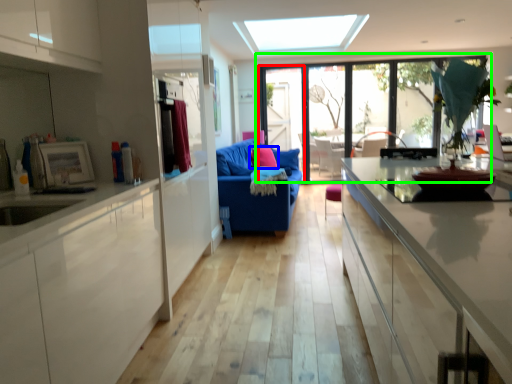
Question: Considering the real-world distances, which object is closest to screen door (highlighted by a red box)? pillow (highlighted by a blue box) or window (highlighted by a green box).

Choices:
 (A) pillow
 (B) window

Answer: (B)